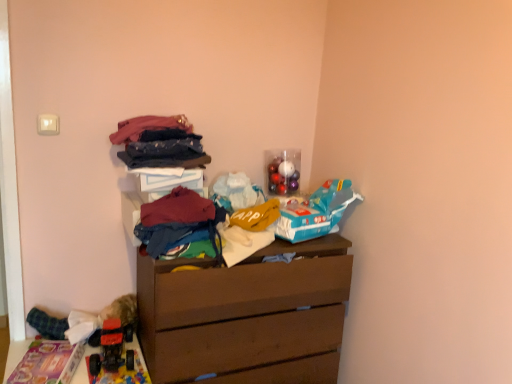
Question: Does plastic toy car at lower left come behind denim jeans at upper center, which is the 2th clothing from top to bottom?

Choices:
 (A) no
 (B) yes

Answer: (A)

Question: Is denim jeans at upper center, which is the 2th clothing from top to bottom, completely or partially inside plastic toy car at lower left?

Choices:
 (A) yes
 (B) no

Answer: (B)

Question: Considering the relative positions of plastic toy car at lower left and denim jeans at upper center, placed as the 4th clothing when sorted from bottom to top, in the image provided, is plastic toy car at lower left to the right of denim jeans at upper center, placed as the 4th clothing when sorted from bottom to top, from the viewer's perspective?

Choices:
 (A) no
 (B) yes

Answer: (A)

Question: Is plastic toy car at lower left positioned far away from denim jeans at upper center, placed as the 4th clothing when sorted from bottom to top?

Choices:
 (A) yes
 (B) no

Answer: (B)

Question: Does plastic toy car at lower left appear on the left side of denim jeans at upper center, which is the 2th clothing from top to bottom?

Choices:
 (A) no
 (B) yes

Answer: (B)

Question: From a real-world perspective, is plush fabric toy at lower left, the 1th toy viewed from the left, physically located above or below denim jeans at upper center, placed as the 4th clothing when sorted from bottom to top?

Choices:
 (A) above
 (B) below

Answer: (B)

Question: Is plush fabric toy at lower left, the second toy positioned from the bottom, spatially inside denim jeans at upper center, placed as the 4th clothing when sorted from bottom to top, or outside of it?

Choices:
 (A) outside
 (B) inside

Answer: (A)

Question: Does point (122, 301) appear closer or farther from the camera than point (173, 150)?

Choices:
 (A) farther
 (B) closer

Answer: (A)

Question: In the image, is plush fabric toy at lower left, the second toy positioned from the bottom, on the left side or the right side of denim jeans at upper center, which is the 2th clothing from top to bottom?

Choices:
 (A) right
 (B) left

Answer: (B)

Question: From a real-world perspective, is brown matte chest of drawers at center above or below blue matte toy airplane at upper right, arranged as the third toy when ordered from the bottom?

Choices:
 (A) above
 (B) below

Answer: (B)

Question: Would you say brown matte chest of drawers at center is inside or outside blue matte toy airplane at upper right, positioned as the second toy in top-to-bottom order?

Choices:
 (A) outside
 (B) inside

Answer: (A)

Question: Is brown matte chest of drawers at center in front of or behind blue matte toy airplane at upper right, positioned as the second toy in top-to-bottom order, in the image?

Choices:
 (A) front
 (B) behind

Answer: (A)

Question: Considering the positions of brown matte chest of drawers at center and blue matte toy airplane at upper right, arranged as the third toy when ordered from the bottom, in the image, is brown matte chest of drawers at center taller or shorter than blue matte toy airplane at upper right, arranged as the third toy when ordered from the bottom,?

Choices:
 (A) short
 (B) tall

Answer: (B)

Question: From their relative heights in the image, would you say plush fabric toy at lower left, which is the third toy in top-to-bottom order, is taller or shorter than dark blue denim jeans at center, which is the third clothing from bottom to top?

Choices:
 (A) short
 (B) tall

Answer: (B)

Question: In terms of width, does plush fabric toy at lower left, the 1th toy viewed from the left, look wider or thinner when compared to dark blue denim jeans at center, which is the 3th clothing from top to bottom?

Choices:
 (A) thin
 (B) wide

Answer: (B)